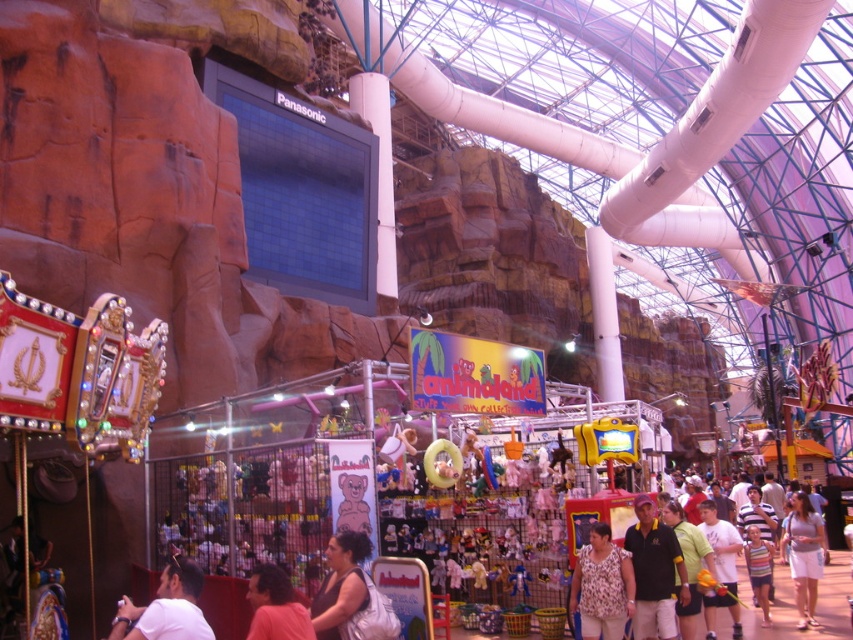
You are a store assistant at Animaland and need to place a new display between the white matte shirt at lower left and the light brown shorts at lower right. Which item should you place closer to the center of the store to ensure the display looks balanced?

The white matte shirt at lower left is smaller than the light brown shorts at lower right, so placing the smaller white matte shirt at lower left closer to the center would help balance the display.

You are standing in the amusement area and see a white matte shirt at lower left and light brown shorts at lower right. Which one is closer to the carnival games on the left side?

The white matte shirt at lower left is closer to the carnival games on the left side since it is positioned to the left of the light brown shorts at lower right.